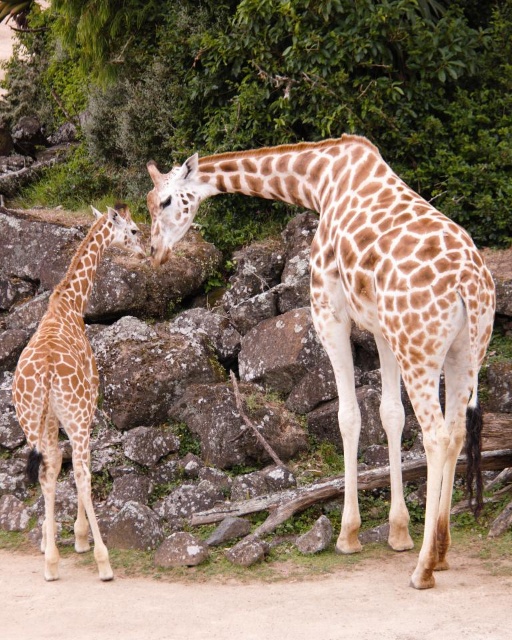
Question: Can you confirm if green leafy tree at upper center is positioned below brown spotted giraffe at left?

Choices:
 (A) yes
 (B) no

Answer: (B)

Question: Which object appears farthest from the camera in this image?

Choices:
 (A) brown spotted giraffe at left
 (B) brown spotted giraffe at center
 (C) green leafy tree at upper center

Answer: (C)

Question: Is brown spotted giraffe at center wider than brown spotted giraffe at left?

Choices:
 (A) yes
 (B) no

Answer: (A)

Question: Estimate the real-world distances between objects in this image. Which object is closer to the brown spotted giraffe at center?

Choices:
 (A) brown spotted giraffe at left
 (B) green leafy tree at upper center

Answer: (A)

Question: Does brown spotted giraffe at center appear under brown spotted giraffe at left?

Choices:
 (A) yes
 (B) no

Answer: (B)

Question: Which object is positioned closest to the brown spotted giraffe at center?

Choices:
 (A) green leafy tree at upper center
 (B) brown spotted giraffe at left

Answer: (B)